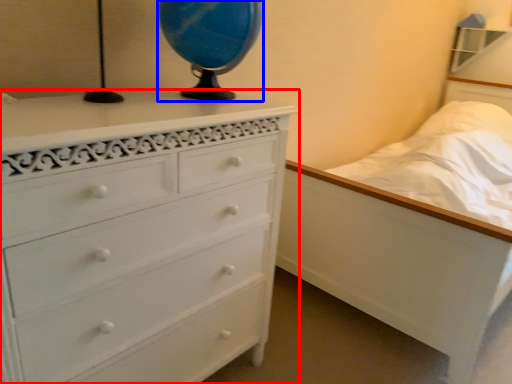
Question: Among these objects, which one is farthest to the camera, chest of drawers (highlighted by a red box) or table lamp (highlighted by a blue box)?

Choices:
 (A) chest of drawers
 (B) table lamp

Answer: (B)